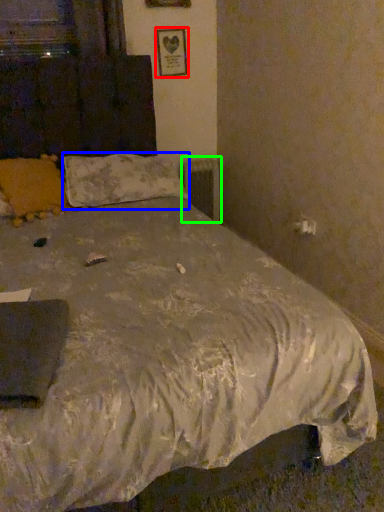
Question: Estimate the real-world distances between objects in this image. Which object is farther from picture frame (highlighted by a red box), pillow (highlighted by a blue box) or radiator (highlighted by a green box)?

Choices:
 (A) pillow
 (B) radiator

Answer: (A)